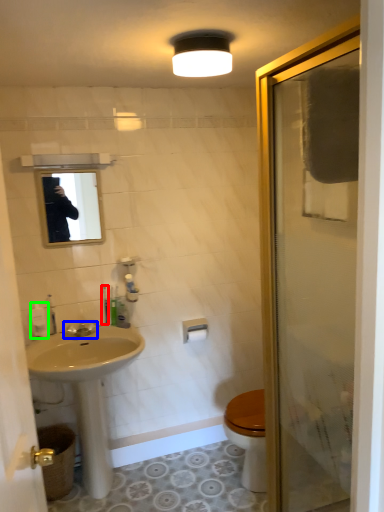
Question: Estimate the real-world distances between objects in this image. Which object is farther from toiletry (highlighted by a red box), tap (highlighted by a blue box) or toiletry (highlighted by a green box)?

Choices:
 (A) tap
 (B) toiletry

Answer: (B)